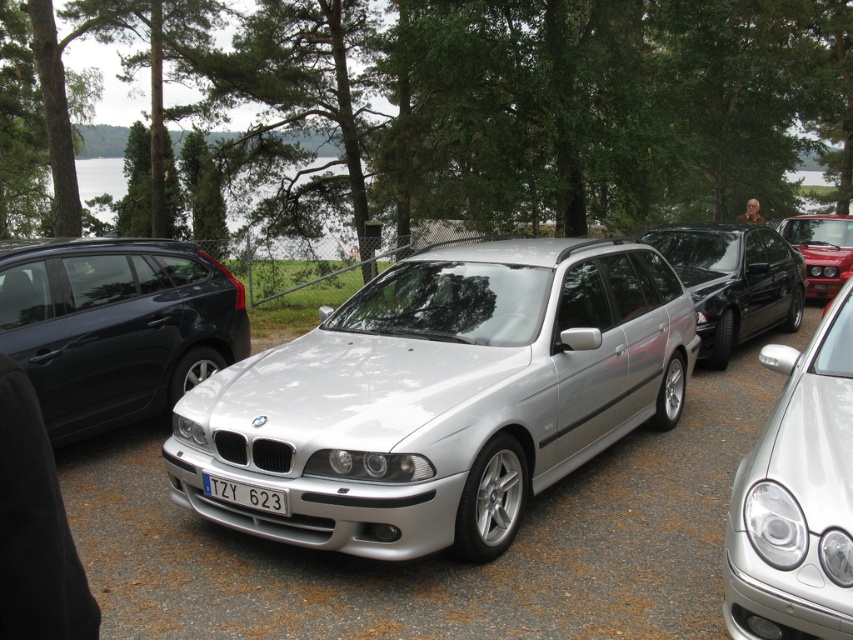
How far apart are matte black station wagon at left and white plastic license plate at center?

They are 2.41 meters apart.

What are the coordinates of `matte black station wagon at left` in the screenshot? It's located at (115, 324).

I want to click on matte black station wagon at left, so click(x=115, y=324).

How much distance is there between silver metallic car at center and satin black sedan at center?

13.28 feet

You are a GUI agent. You are given a task and a screenshot of the screen. Output one action in this format:
    pyautogui.click(x=<x>, y=<y>)
    Task: Click on the silver metallic car at center
    
    Given the screenshot: What is the action you would take?
    pyautogui.click(x=442, y=396)

I want to click on silver metallic car at center, so click(442, 396).

From the picture: Who is more distant from viewer, (361,545) or (805,467)?

Point (361,545)

Is silver metallic car at center further to camera compared to satin silver car at center?

Yes, silver metallic car at center is behind satin silver car at center.

You are a GUI agent. You are given a task and a screenshot of the screen. Output one action in this format:
    pyautogui.click(x=<x>, y=<y>)
    Task: Click on the silver metallic car at center
    
    Given the screenshot: What is the action you would take?
    pyautogui.click(x=442, y=396)